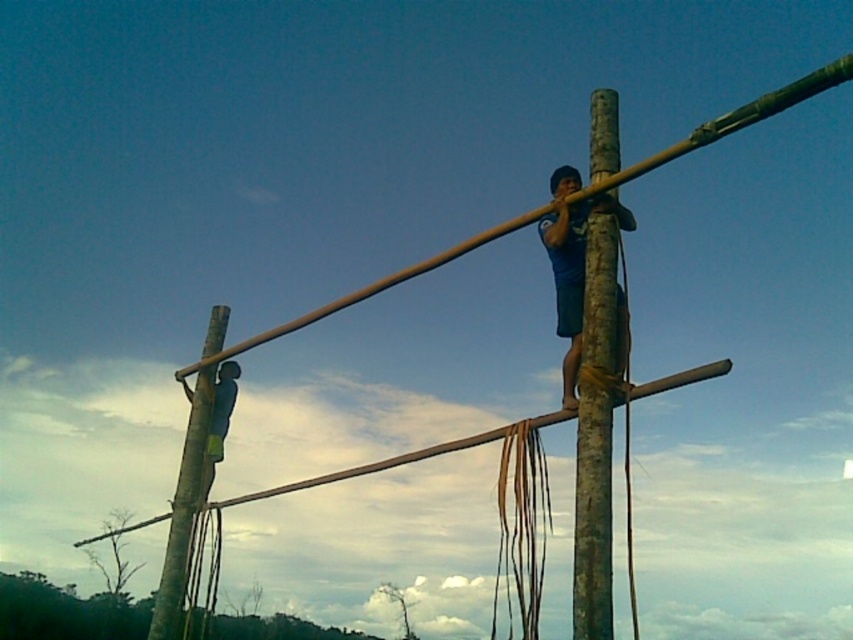
In the scene shown: What is the 2D coordinate of the brown wood pole at center in the image?

The brown wood pole at center is located at the 2D coordinate point of (729,124).

You are planning to hang a swing between the brown wood pole at center and the brown wood pole at left. Considering their heights, which pole will require you to climb higher to attach the swing?

The brown wood pole at center is taller than the brown wood pole at left, so you will need to climb higher to attach the swing to the brown wood pole at center.